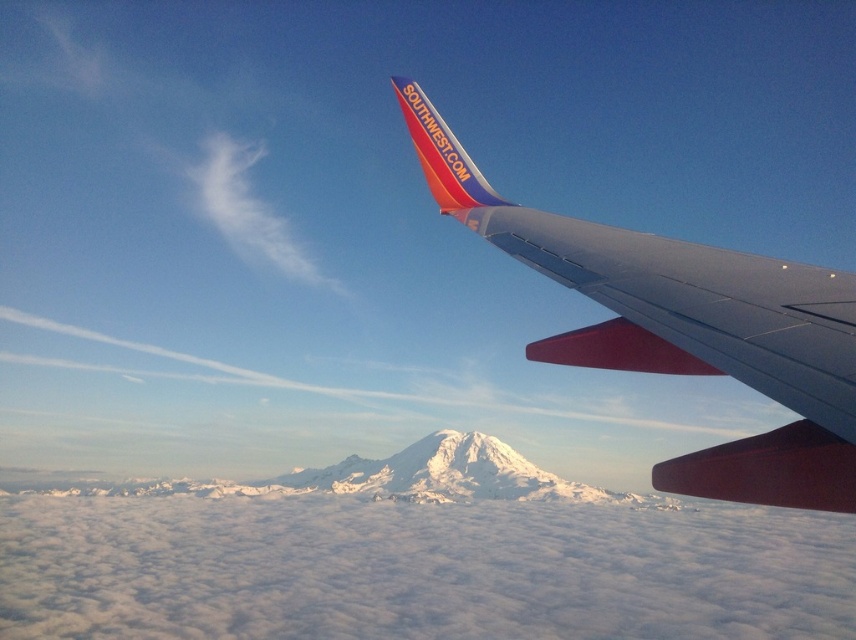
Can you confirm if smooth metallic wing at upper right is positioned to the left of white cotton cloud at upper left?

No, smooth metallic wing at upper right is not to the left of white cotton cloud at upper left.

Which is behind, point (655, 269) or point (305, 259)?

Point (305, 259)

Locate an element on the screen. The image size is (856, 640). smooth metallic wing at upper right is located at coordinates (705, 305).

Based on the photo, who is more forward, [203,156] or [408,80]?

Point [408,80] is more forward.

Image resolution: width=856 pixels, height=640 pixels. Describe the element at coordinates (248, 211) in the screenshot. I see `white cotton cloud at upper left` at that location.

What do you see at coordinates (248, 211) in the screenshot? I see `white cotton cloud at upper left` at bounding box center [248, 211].

I want to click on white cotton cloud at upper left, so click(248, 211).

Find the location of a particular element. metallic gray wing at upper right is located at coordinates (684, 326).

Between metallic gray wing at upper right and white cotton cloud at upper left, which one is positioned lower?

metallic gray wing at upper right is below.

Find the location of a particular element. This screenshot has width=856, height=640. metallic gray wing at upper right is located at coordinates (684, 326).